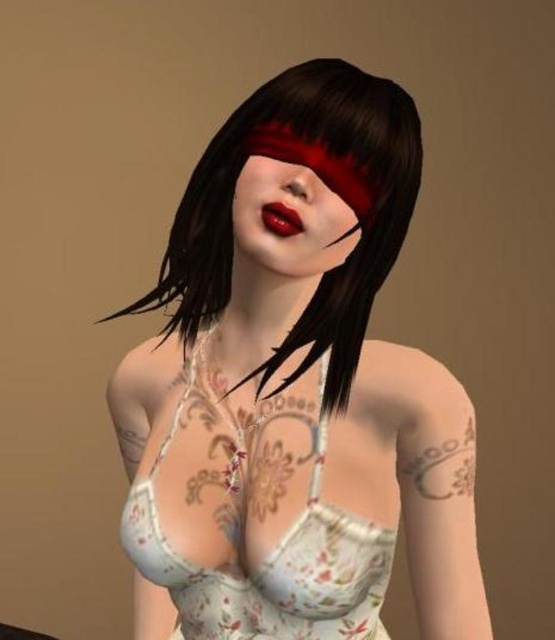
What is the color of the clothing item located at the coordinates point [295,388]?

The point [295,388] is on matte white lingerie at center.

You are a makeup artist observing the person in the image. You need to apply a new shade of lipstick. Which object, the matte white lingerie at center or the matte red lipstick at center, should you focus on first if you want to work on the item that is closer to you?

The matte white lingerie at center is closer to the viewer than the matte red lipstick at center, so you should focus on the matte white lingerie at center first.

You are a fashion designer analyzing this digital art piece. You notice the matte white lingerie at center and the matte red lipstick at center. Which of these two items is positioned higher up in the image?

The matte white lingerie at center is taller than the matte red lipstick at center, so the lingerie is positioned higher up in the image.